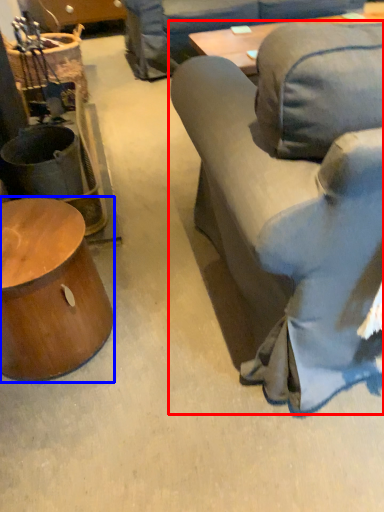
Question: Which object is closer to the camera taking this photo, studio couch (highlighted by a red box) or table (highlighted by a blue box)?

Choices:
 (A) studio couch
 (B) table

Answer: (A)